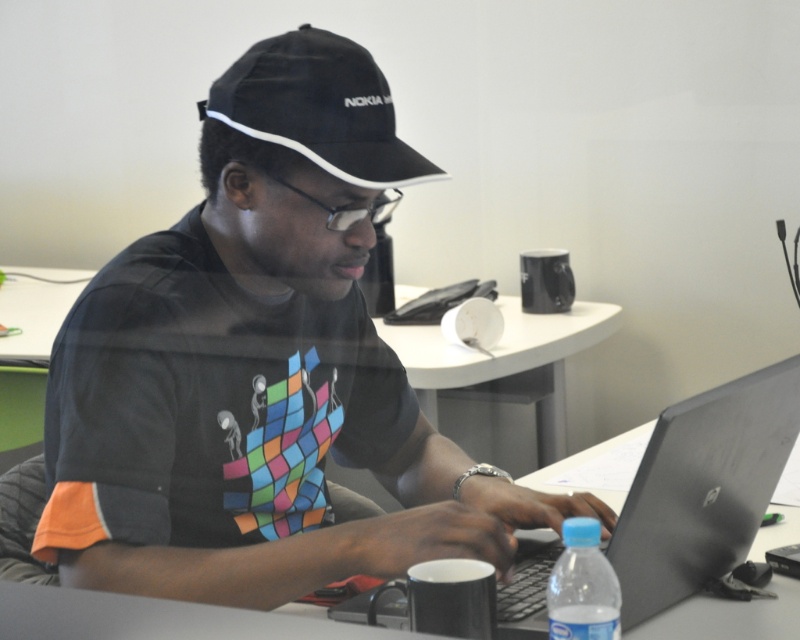
You are trying to place a new monitor on the desk. Based on the scene, can you determine if the silver metallic laptop at center will block the placement of the monitor on the white glossy table at center?

The silver metallic laptop at center is in front of the white glossy table at center, so placing a new monitor might be blocked by the laptop. Move the laptop first before placing the monitor.

You are organizing a small event and need to place a 20 cm wide decorative item on the desk. The white glossy table at center and the black fabric baseball hat at upper center are both potential spots. Which object can accommodate the item based on their sizes?

The white glossy table at center has a larger width than the black fabric baseball hat at upper center, so the decorative item can be placed on the white glossy table at center.